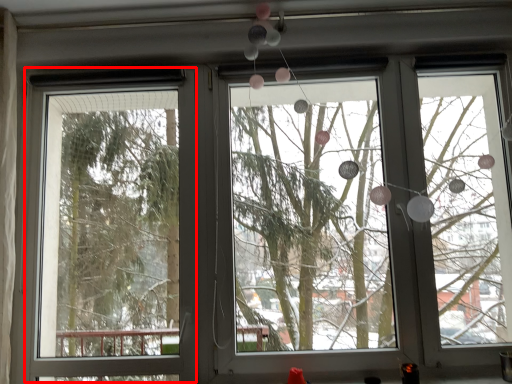
Question: From the image's perspective, what is the correct spatial relationship of screen door (annotated by the red box) in relation to bay window?

Choices:
 (A) below
 (B) above

Answer: (A)